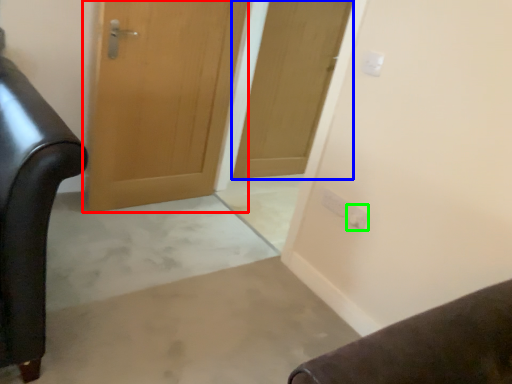
Question: Which is nearer to the door (highlighted by a red box)? door (highlighted by a blue box) or electric outlet (highlighted by a green box).

Choices:
 (A) door
 (B) electric outlet

Answer: (A)